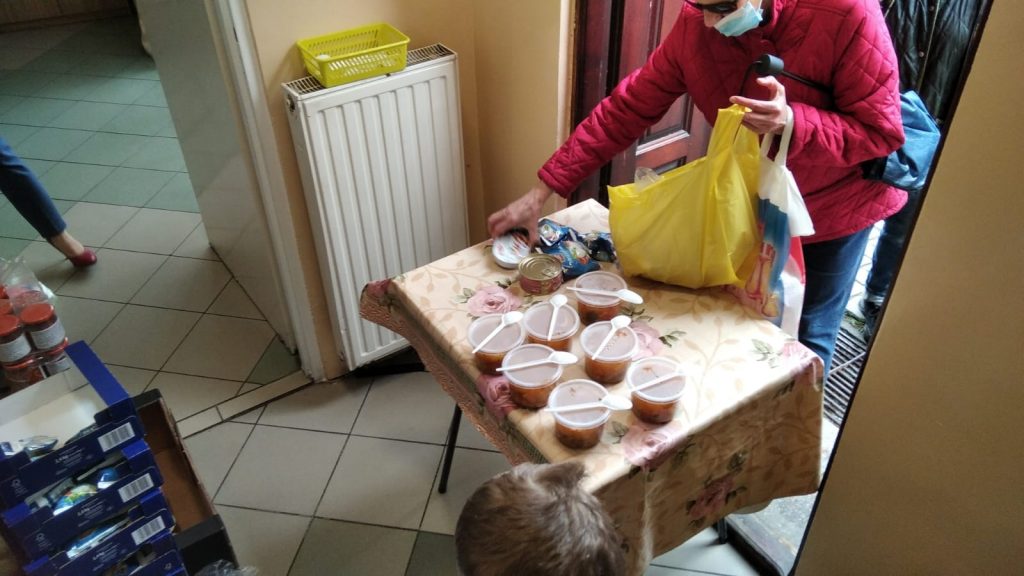
The image size is (1024, 576). I want to click on table, so click(482, 287), click(675, 346), click(638, 420).